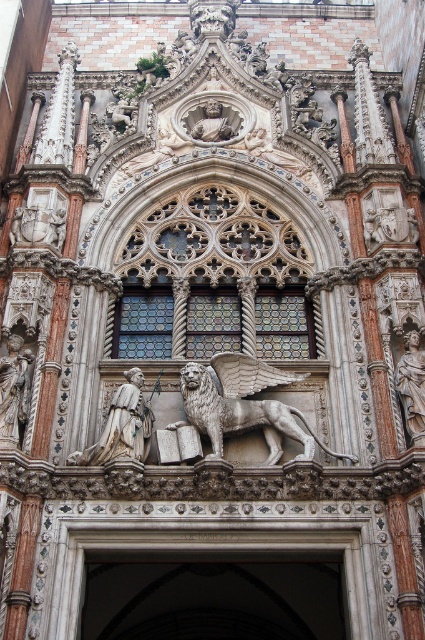
You are an art student analyzing the facade. You observe the polished stone lion at center and the polished stone statue at right. Which of these two objects is larger in size?

The polished stone lion at center is bigger than the polished stone statue at right according to the description.

You are an architect analyzing the facade of a historical building. You observe the white stone arch at center and the white marble statue at center. Which of these two elements has a greater height?

The white stone arch at center has a greater height compared to the white marble statue at center.